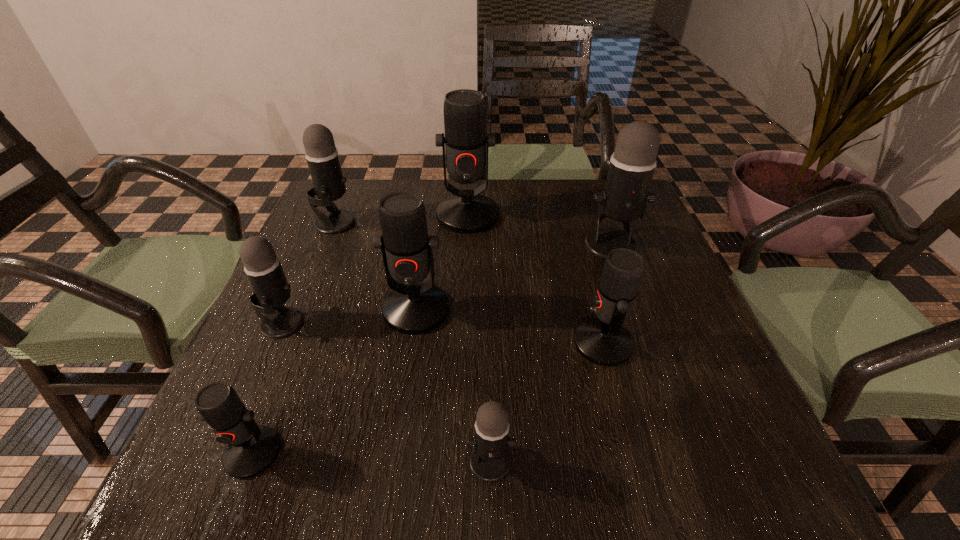
Image resolution: width=960 pixels, height=540 pixels. In order to click on the farthest red microphone in this screenshot , I will do `click(467, 211)`.

I want to click on the rightmost gray microphone, so click(632, 165).

This screenshot has height=540, width=960. I want to click on the second biggest gray microphone, so click(322, 157).

You are a GUI agent. You are given a task and a screenshot of the screen. Output one action in this format:
    pyautogui.click(x=<x>, y=<y>)
    Task: Click on the third smallest red microphone
    This screenshot has width=960, height=540.
    Given the screenshot: What is the action you would take?
    pyautogui.click(x=413, y=307)

At what (x,y) coordinates should I click in order to perform the action: click on the third biggest red microphone. Please return your answer as a coordinate pair (x, y). The image size is (960, 540). Looking at the image, I should click on (604, 341).

Find the location of a particular element. The image size is (960, 540). the third farthest gray microphone is located at coordinates (271, 290).

I want to click on the smallest red microphone, so click(250, 449).

Locate an element on the screen. The image size is (960, 540). the leftmost red microphone is located at coordinates (250, 449).

At what (x,y) coordinates should I click in order to perform the action: click on the nearest gray microphone. Please return your answer as a coordinate pair (x, y). The image size is (960, 540). Looking at the image, I should click on (490, 461).

The width and height of the screenshot is (960, 540). What are the coordinates of `the second gray microphone from right to left` in the screenshot? It's located at (490, 461).